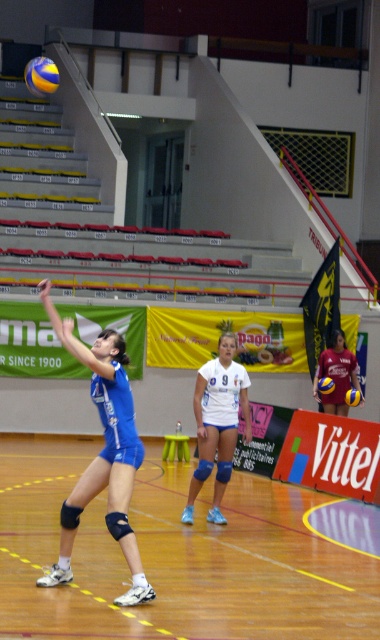
Question: Among these objects, which one is farthest from the camera?

Choices:
 (A) white jersey at center
 (B) wooden floor at center
 (C) yellow matte volleyball at center

Answer: (A)

Question: Can you confirm if blue uniform at center is positioned above white matte/vinyl jersey at center?

Choices:
 (A) yes
 (B) no

Answer: (A)

Question: Among these objects, which one is farthest from the camera?

Choices:
 (A) yellow matte volleyball at center
 (B) yellow matte volleyball at upper left

Answer: (A)

Question: Considering the relative positions of wooden floor at center and blue uniform at center in the image provided, where is wooden floor at center located with respect to blue uniform at center?

Choices:
 (A) right
 (B) left

Answer: (A)

Question: Is white jersey at center above yellow and blue textured volleyball at center?

Choices:
 (A) no
 (B) yes

Answer: (B)

Question: Among these points, which one is nearest to the camera?

Choices:
 (A) pyautogui.click(x=185, y=534)
 (B) pyautogui.click(x=321, y=392)

Answer: (A)